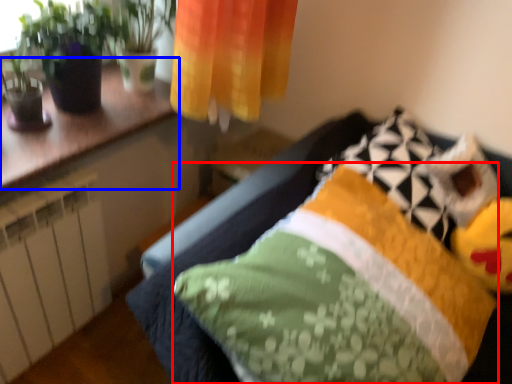
Question: Which point is further to the camera, pillow (highlighted by a red box) or counter top (highlighted by a blue box)?

Choices:
 (A) pillow
 (B) counter top

Answer: (B)